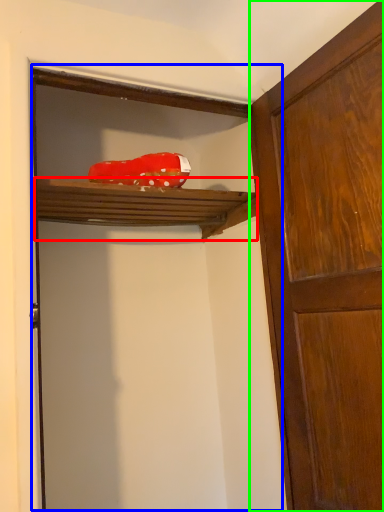
Question: Which is nearer to the shelf (highlighted by a red box)? door (highlighted by a blue box) or door (highlighted by a green box).

Choices:
 (A) door
 (B) door

Answer: (A)